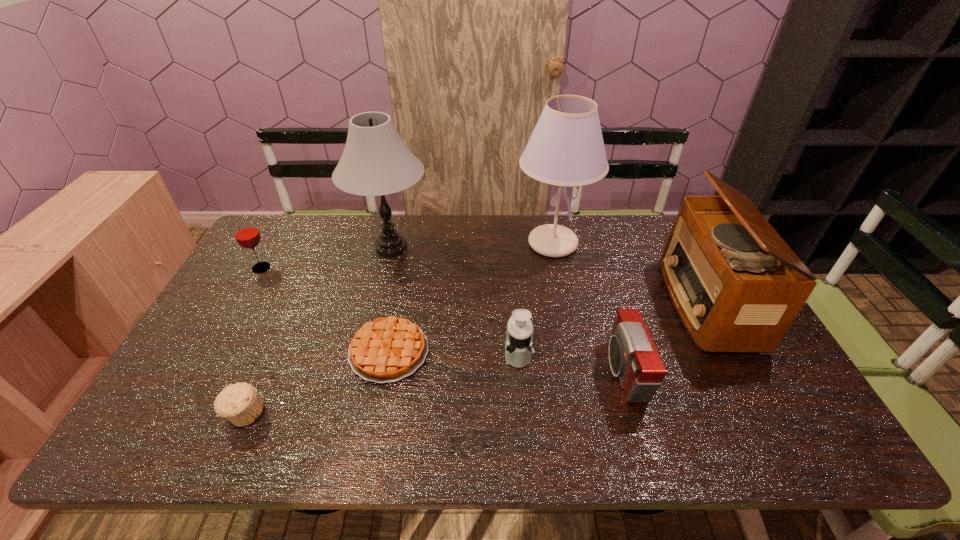
This screenshot has height=540, width=960. I want to click on lampshade, so click(x=566, y=148).

In order to click on lamp in this screenshot , I will do `click(375, 162)`.

This screenshot has height=540, width=960. In order to click on radio receiver in this screenshot , I will do `click(727, 271)`.

This screenshot has height=540, width=960. Identify the location of the sixth shortest object. (727, 271).

Where is `glass`? This screenshot has width=960, height=540. glass is located at coordinates (247, 235).

I want to click on juicer, so click(519, 337).

This screenshot has width=960, height=540. Identify the location of camera. (633, 357).

Locate an element on the screen. This screenshot has height=540, width=960. muffin is located at coordinates pyautogui.click(x=241, y=403).

Find the location of a particular element. The height and width of the screenshot is (540, 960). the seventh tallest object is located at coordinates (241, 403).

Find the location of a particular element. The image size is (960, 540). pie is located at coordinates (389, 349).